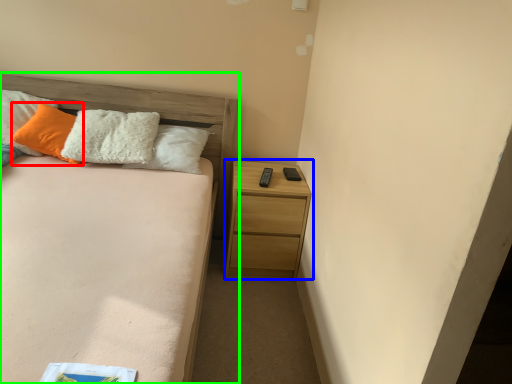
Question: Which object is positioned farthest from pillow (highlighted by a red box)? Select from nightstand (highlighted by a blue box) and bed (highlighted by a green box).

Choices:
 (A) nightstand
 (B) bed

Answer: (A)